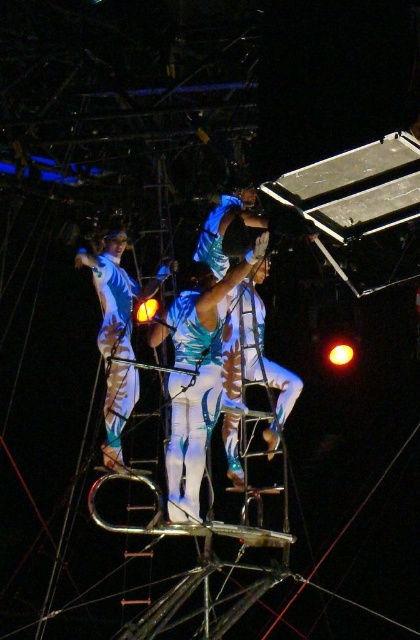
You are a photographer positioned at the front of the circus stage. You want to capture a clear photo of the white glossy leotard at upper center without the shiny teal fabric at center blocking it. Is this possible given their positions?

The shiny teal fabric at center is in front of the white glossy leotard at upper center, so it will block the view. To capture the white glossy leotard at upper center clearly, you need to adjust your angle or move the shiny teal fabric at center out of the way.

You are a safety inspector at the circus. You need to ensure that the distance between the shiny metallic costume at center and the white glossy leotard at upper center is at least 3 meters to prevent collisions during the performance. Is the current distance sufficient?

The shiny metallic costume at center is 3.38 meters from the white glossy leotard at upper center, which is more than the required 3 meters. Therefore, the distance is sufficient to prevent collisions during the performance.

You are an acrobat in the circus scene. You need to determine which of the two points, point (241, 477) or point (170, 269), is closer to you. Which one should you choose?

Point (241, 477) is closer to the viewer than point (170, 269), so you should choose point (241, 477).